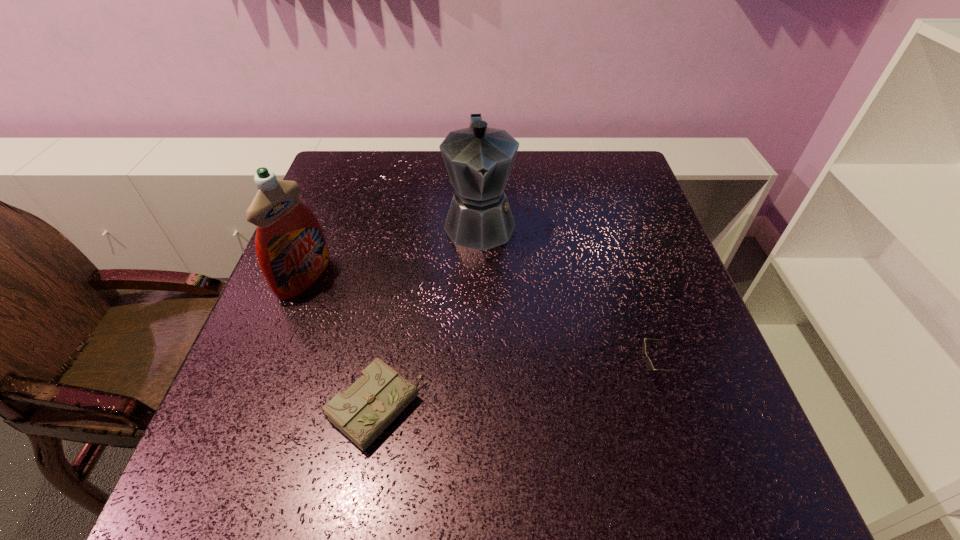
Where is `free space on the desktop that is between the diary and the rightmost object and is positioned on the front surface of the detergent`? The image size is (960, 540). free space on the desktop that is between the diary and the rightmost object and is positioned on the front surface of the detergent is located at coordinates (543, 387).

Identify the location of vacant space on the desktop that is between the shortest object and the third tallest object and is positioned at the spout of the coffeepot. This screenshot has height=540, width=960. (498, 393).